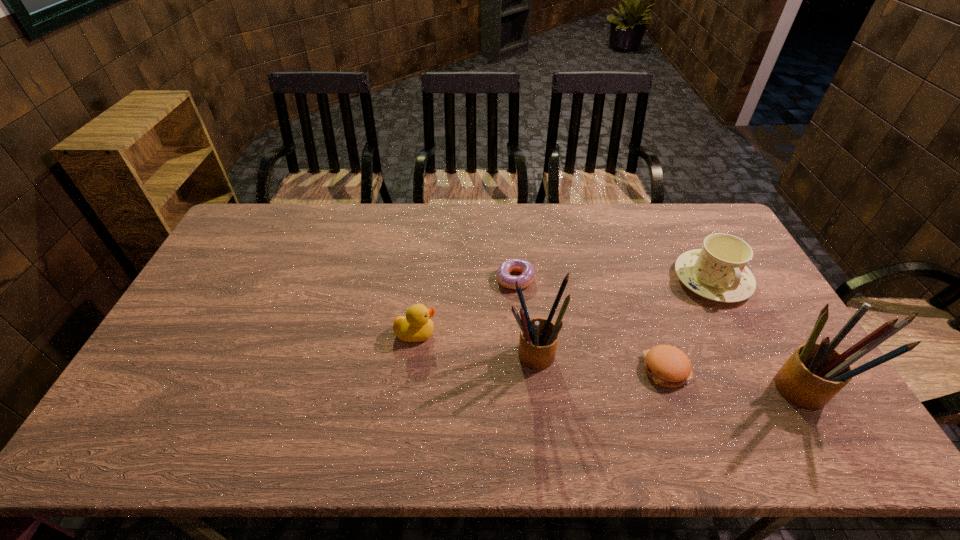
You are a GUI agent. You are given a task and a screenshot of the screen. Output one action in this format:
    pyautogui.click(x=<x>, y=<y>)
    Task: Click on the free location that satisfies the following two spatial constraints: 1. on the front side of the doughnut; 2. on the left side of the fourth object from left to right
    
    Given the screenshot: What is the action you would take?
    pyautogui.click(x=522, y=370)

You are a GUI agent. You are given a task and a screenshot of the screen. Output one action in this format:
    pyautogui.click(x=<x>, y=<y>)
    Task: Click on the vacant area that satisfies the following two spatial constraints: 1. on the face of the tallest object; 2. on the left side of the duckling
    
    Given the screenshot: What is the action you would take?
    pyautogui.click(x=409, y=389)